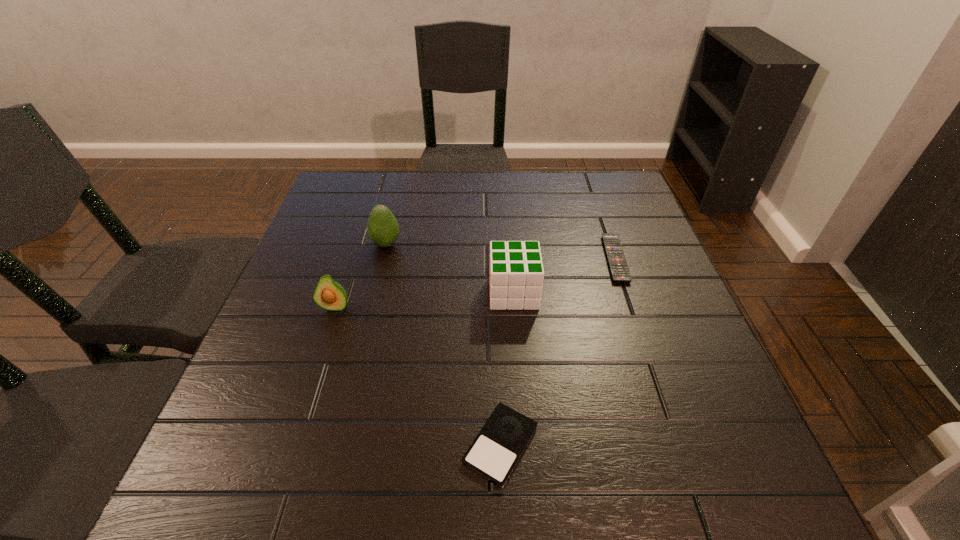
The height and width of the screenshot is (540, 960). I want to click on the fourth object from right to left, so click(x=382, y=227).

Locate an element on the screen. The height and width of the screenshot is (540, 960). the farther avocado is located at coordinates (382, 227).

You are a GUI agent. You are given a task and a screenshot of the screen. Output one action in this format:
    pyautogui.click(x=<x>, y=<y>)
    Task: Click on the cube
    The image size is (960, 540).
    Given the screenshot: What is the action you would take?
    pyautogui.click(x=516, y=274)

Locate an element on the screen. This screenshot has width=960, height=540. the left avocado is located at coordinates (329, 294).

Identify the location of the nearer avocado. Image resolution: width=960 pixels, height=540 pixels. (329, 294).

Where is `remote control`? The height and width of the screenshot is (540, 960). remote control is located at coordinates (619, 269).

The width and height of the screenshot is (960, 540). In order to click on iPod in this screenshot , I will do `click(494, 453)`.

At what (x,y) coordinates should I click in order to perform the action: click on blank space located on the right of the farther avocado. Please return your answer as a coordinate pair (x, y). This screenshot has width=960, height=540. Looking at the image, I should click on 470,244.

In order to click on free spot located on the red face of the cube in this screenshot , I will do `click(321, 293)`.

The width and height of the screenshot is (960, 540). I want to click on free point located on the red face of the cube, so click(368, 293).